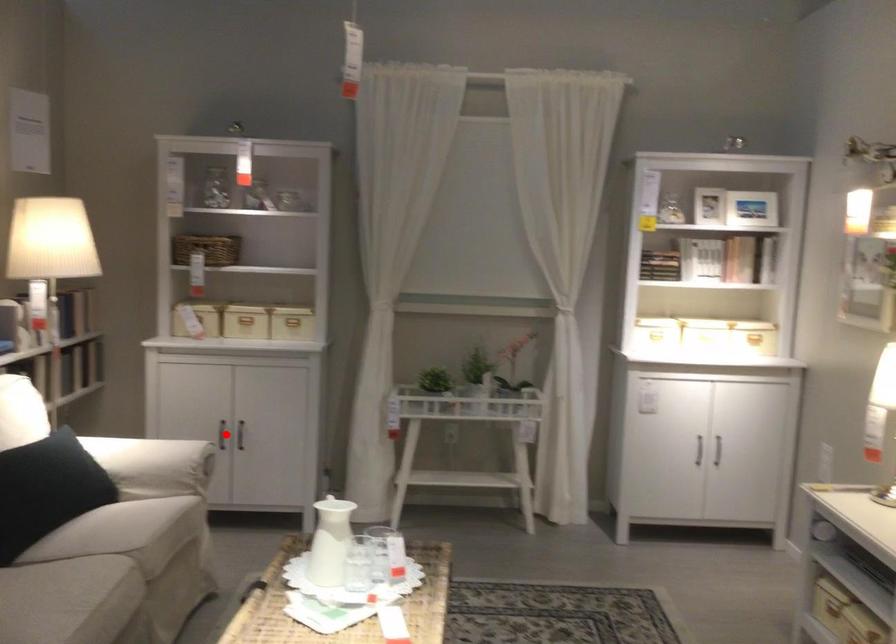
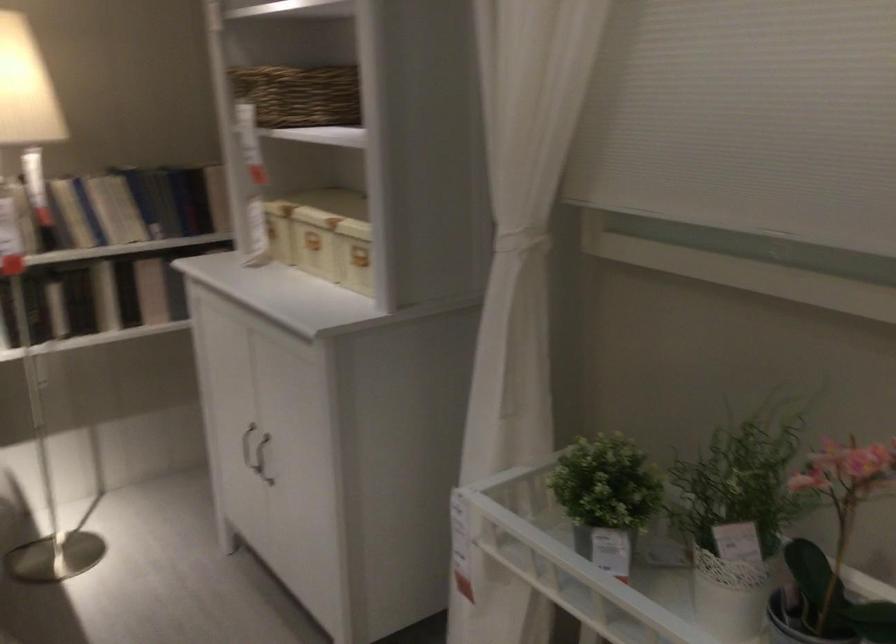
Question: I am providing you with two images of the same scene from different viewpoints. A red point is marked on the first image. Can you still see the location of the red point in image 2?

Choices:
 (A) Yes
 (B) No

Answer: (A)